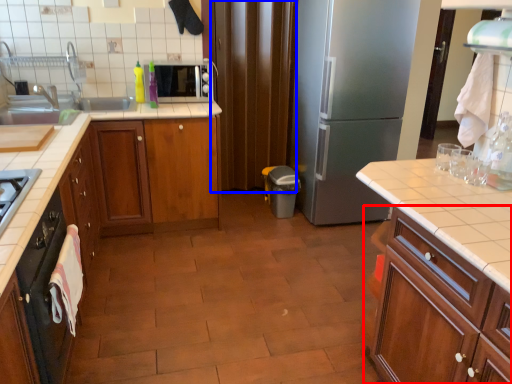
Question: Which of the following is the farthest to the observer, cabinetry (highlighted by a red box) or curtain (highlighted by a blue box)?

Choices:
 (A) cabinetry
 (B) curtain

Answer: (B)